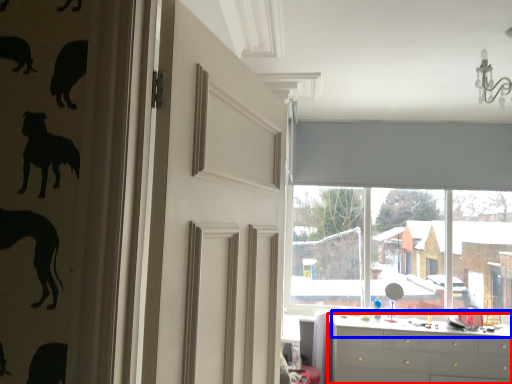
Question: Which point is further to the camera, chest of drawers (highlighted by a red box) or counter top (highlighted by a blue box)?

Choices:
 (A) chest of drawers
 (B) counter top

Answer: (B)